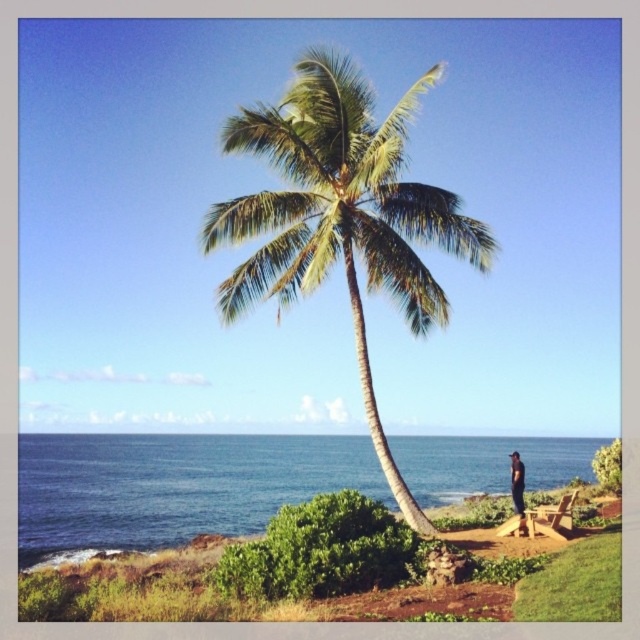
Question: Is green leafy coconut tree at center closer to the viewer compared to blue water at lower left?

Choices:
 (A) yes
 (B) no

Answer: (A)

Question: Does blue water at lower left come behind dark blue jeans at lower right?

Choices:
 (A) no
 (B) yes

Answer: (B)

Question: Considering the real-world distances, which object is farthest from the dark blue jeans at lower right?

Choices:
 (A) green leafy coconut tree at center
 (B) blue water at lower left

Answer: (B)

Question: Among these objects, which one is farthest from the camera?

Choices:
 (A) blue water at lower left
 (B) green leafy coconut tree at center

Answer: (A)

Question: Estimate the real-world distances between objects in this image. Which object is closer to the dark blue jeans at lower right?

Choices:
 (A) blue water at lower left
 (B) green leafy coconut tree at center

Answer: (B)

Question: Is green leafy coconut tree at center above dark blue jeans at lower right?

Choices:
 (A) no
 (B) yes

Answer: (B)